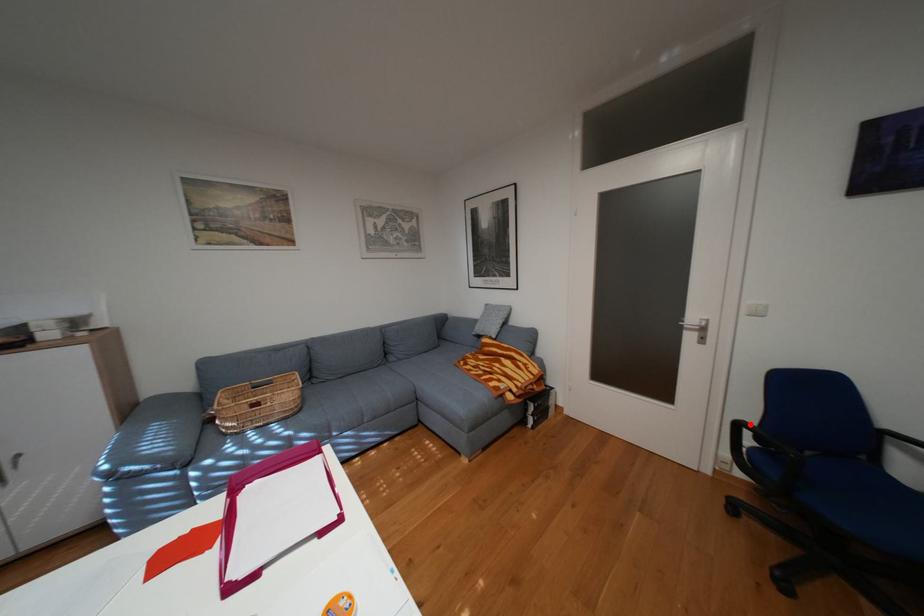
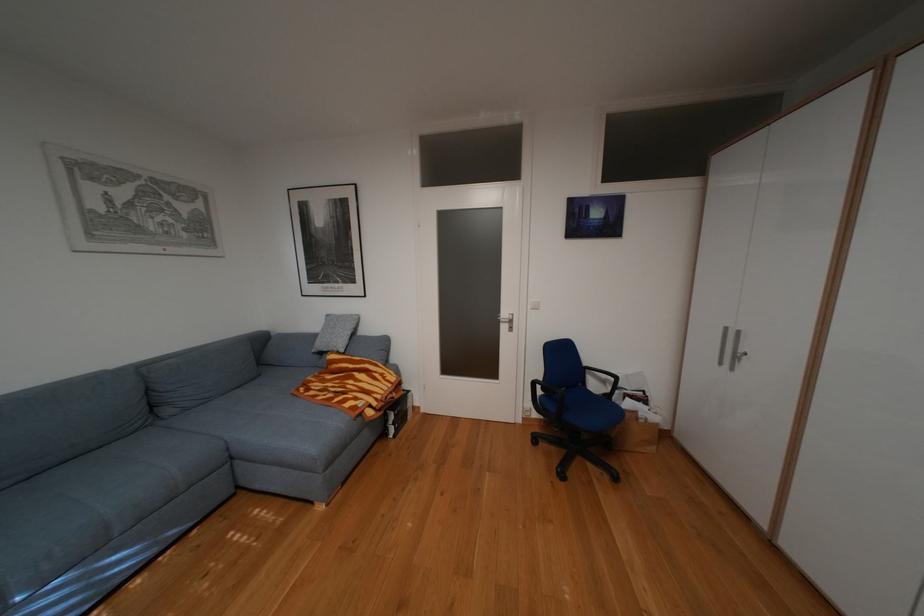
Locate, in the second image, the point that corresponds to the highlighted location in the first image.

(545, 383)